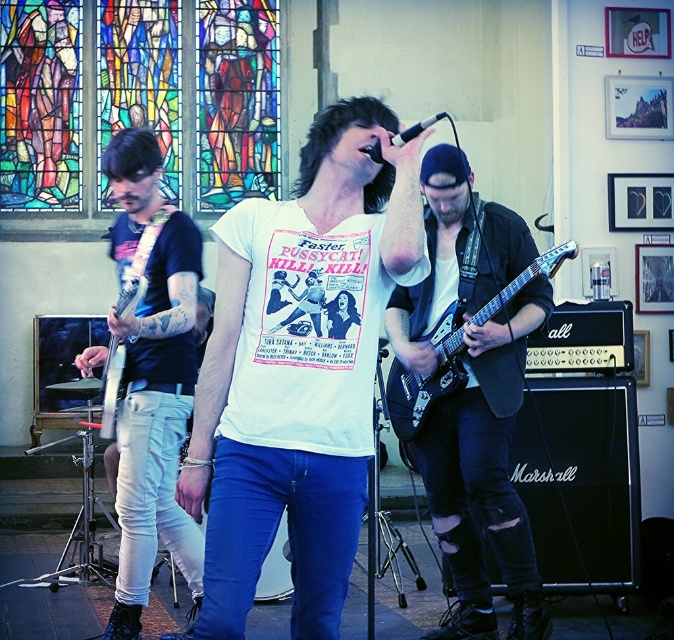
Can you confirm if white matte t-shirt at center is positioned below dark blue jeans at left?

No, white matte t-shirt at center is not below dark blue jeans at left.

Who is positioned more to the right, white matte t-shirt at center or dark blue jeans at left?

white matte t-shirt at center

Does point (317, 180) come closer to viewer compared to point (191, 365)?

Yes.

In order to click on white matte t-shirt at center in this screenshot , I will do `click(299, 368)`.

Is white matte t-shirt at center below white cotton t-shirt at center?

Incorrect, white matte t-shirt at center is not positioned below white cotton t-shirt at center.

Is point (264, 493) less distant than point (373, 268)?

Yes, it is in front of point (373, 268).

Find the location of `white matte t-shirt at center`. white matte t-shirt at center is located at coordinates click(x=299, y=368).

At what (x,y) coordinates should I click in order to perform the action: click on white matte t-shirt at center. Please return your answer as a coordinate pair (x, y). The width and height of the screenshot is (674, 640). Looking at the image, I should click on (299, 368).

Is matte black guitar at center to the left of white cotton t-shirt at center from the viewer's perspective?

Incorrect, matte black guitar at center is not on the left side of white cotton t-shirt at center.

Identify the location of matte black guitar at center. (485, 476).

Locate an element on the screen. matte black guitar at center is located at coordinates (485, 476).